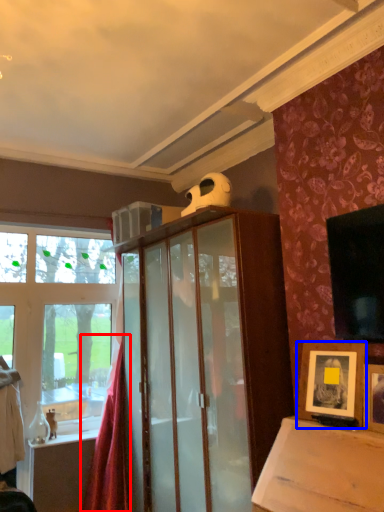
Question: Which object is closer to the camera taking this photo, curtain (highlighted by a red box) or picture frame (highlighted by a blue box)?

Choices:
 (A) curtain
 (B) picture frame

Answer: (B)